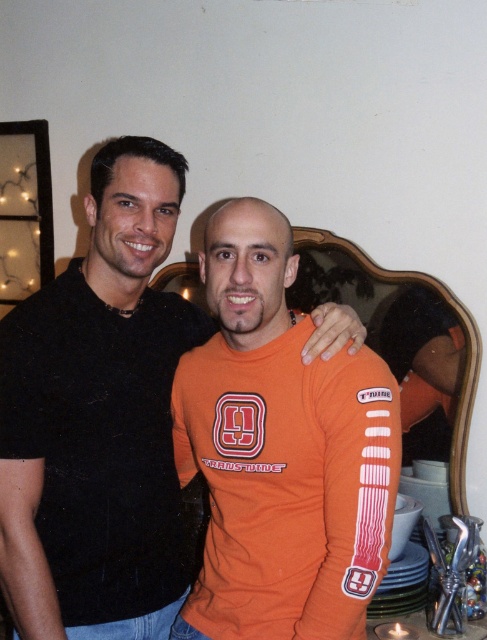
Between point (126, 470) and point (210, 566), which one is positioned behind?

The point (210, 566) is more distant.

Who is positioned more to the right, orange matte t-shirt at center or orange jersey at center?

orange jersey at center is more to the right.

What do you see at coordinates (97, 413) in the screenshot? I see `orange matte t-shirt at center` at bounding box center [97, 413].

Locate an element on the screen. Image resolution: width=487 pixels, height=640 pixels. orange matte t-shirt at center is located at coordinates (97, 413).

Is orange jersey at center to the left of black matte t-shirt at left from the viewer's perspective?

Incorrect, orange jersey at center is not on the left side of black matte t-shirt at left.

Describe the element at coordinates (287, 484) in the screenshot. I see `orange jersey at center` at that location.

I want to click on orange jersey at center, so click(x=287, y=484).

Who is taller, orange matte t-shirt at center or black matte t-shirt at left?

orange matte t-shirt at center

Between point (104, 477) and point (16, 417), which one is positioned behind?

Positioned behind is point (104, 477).

Locate an element on the screen. The width and height of the screenshot is (487, 640). orange matte t-shirt at center is located at coordinates (97, 413).